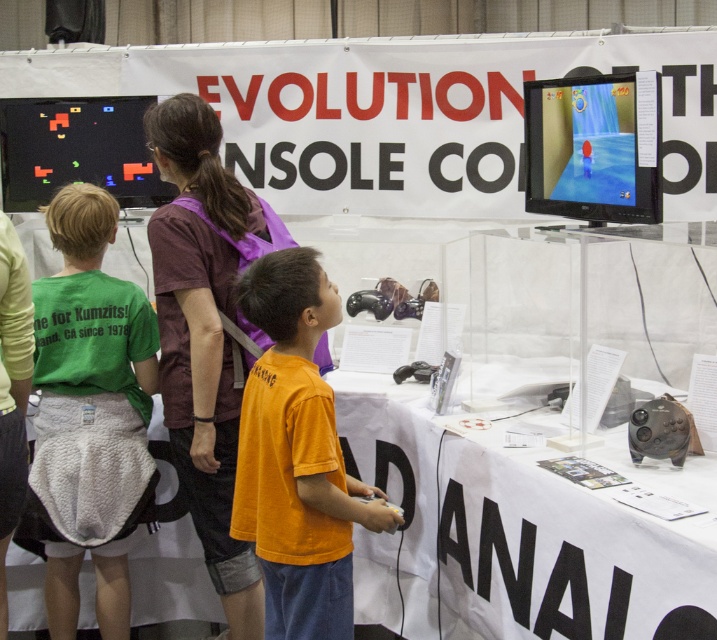
Question: Is green fleece skirt at lower left above green fleece jacket at left?

Choices:
 (A) yes
 (B) no

Answer: (A)

Question: Which object is farther from the camera taking this photo?

Choices:
 (A) purple fabric shirt at center
 (B) green fleece skirt at lower left

Answer: (B)

Question: Can you confirm if white fabric table at center is wider than green fleece skirt at lower left?

Choices:
 (A) no
 (B) yes

Answer: (B)

Question: Which of the following is the closest to the observer?

Choices:
 (A) click(419, 392)
 (B) click(265, 435)

Answer: (B)

Question: Is purple fabric shirt at center thinner than green fleece skirt at lower left?

Choices:
 (A) yes
 (B) no

Answer: (B)

Question: Which of the following is the farthest from the observer?

Choices:
 (A) (181, 150)
 (B) (277, 291)
 (C) (123, 388)
 (D) (554, 150)

Answer: (C)